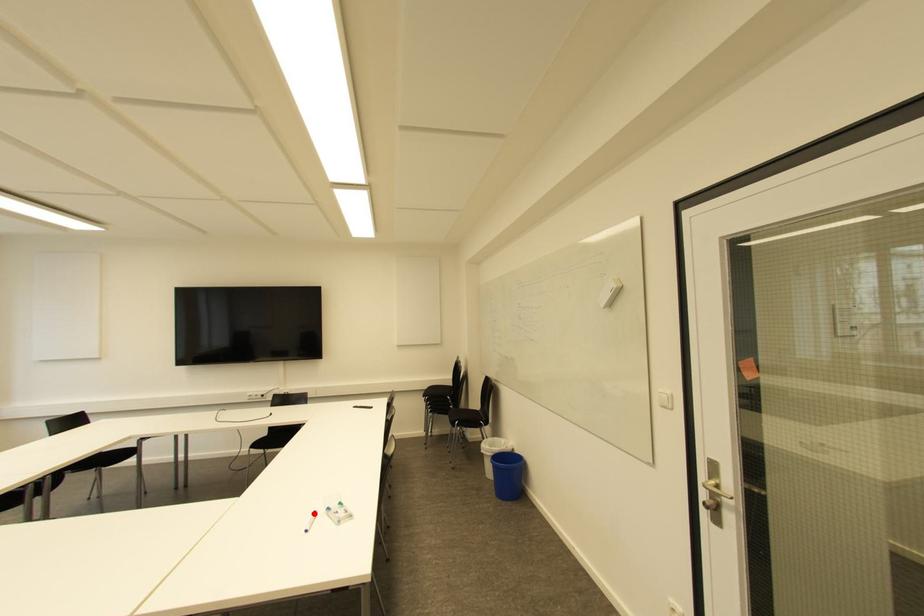
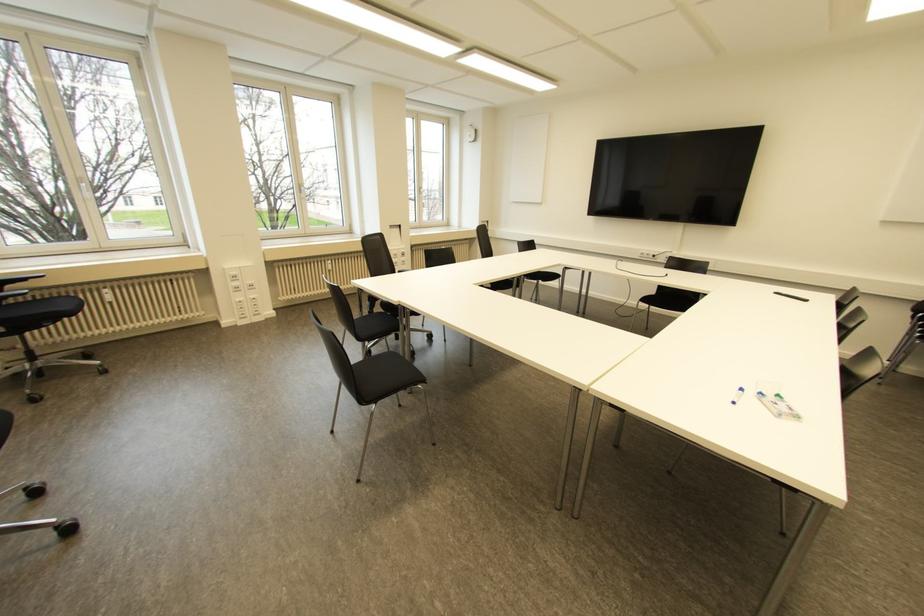
The point at the highlighted location is marked in the first image. Where is the corresponding point in the second image?

(739, 390)